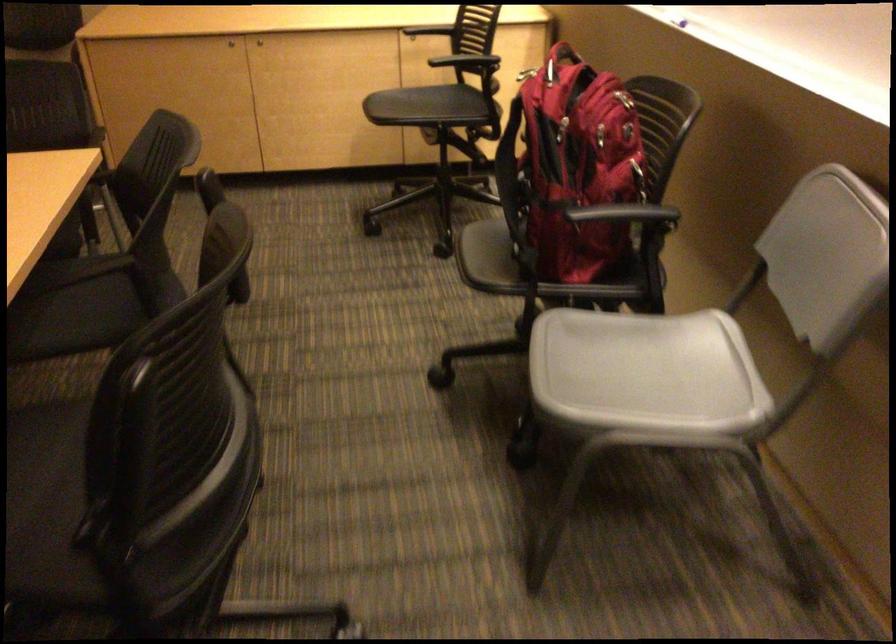
Locate an element on the screen. The width and height of the screenshot is (896, 644). red backpack handle is located at coordinates (511, 171).